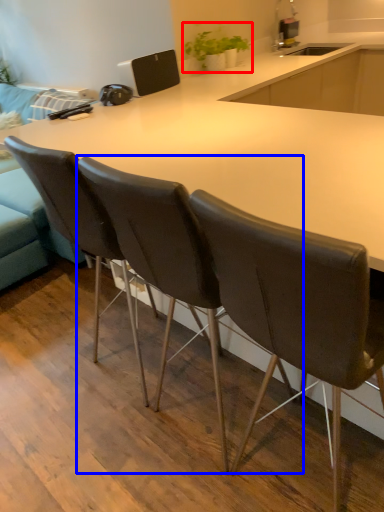
Question: Which point is further to the camera, houseplant (highlighted by a red box) or chair (highlighted by a blue box)?

Choices:
 (A) houseplant
 (B) chair

Answer: (A)